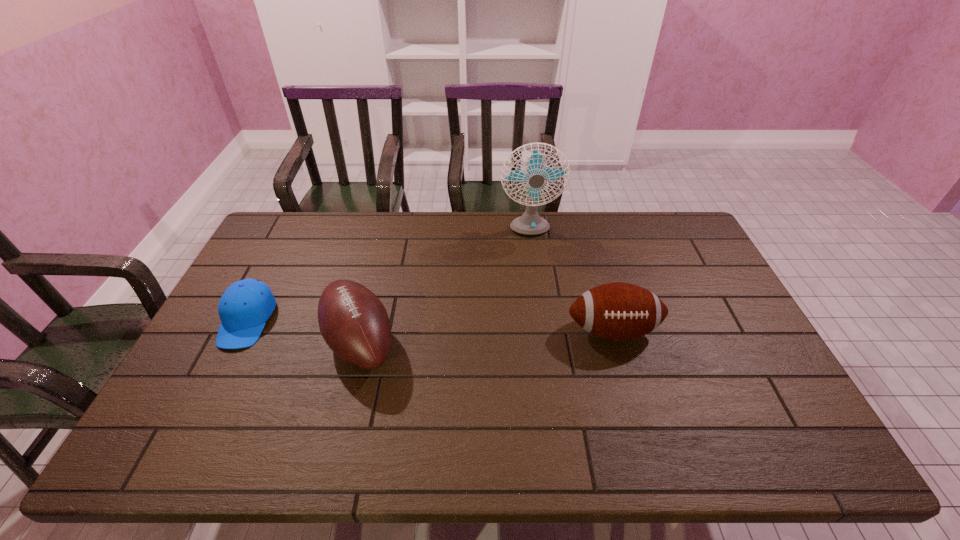
Where is `the farthest object`? This screenshot has width=960, height=540. the farthest object is located at coordinates (530, 223).

Where is `the tallest object`? This screenshot has width=960, height=540. the tallest object is located at coordinates (530, 223).

Locate an element on the screen. the second object from left to right is located at coordinates (354, 323).

Image resolution: width=960 pixels, height=540 pixels. Find the location of `the right football`. the right football is located at coordinates (619, 311).

Identify the location of the shortest object. (245, 306).

Image resolution: width=960 pixels, height=540 pixels. In order to click on the leftmost object in this screenshot , I will do click(245, 306).

Identify the location of vacant space located 0.350m on the front-facing side of the fan. The width and height of the screenshot is (960, 540). (540, 319).

You are a GUI agent. You are given a task and a screenshot of the screen. Output one action in this format:
    pyautogui.click(x=<x>, y=<y>)
    Task: Click on the vacant position located on the front of the second object from left to right
    This screenshot has height=540, width=960.
    Given the screenshot: What is the action you would take?
    pyautogui.click(x=342, y=416)

You are a GUI agent. You are given a task and a screenshot of the screen. Output one action in this format:
    pyautogui.click(x=<x>, y=<y>)
    Task: Click on the vacant space situated 0.300m on the laces of the right football
    The image size is (960, 540).
    Given the screenshot: What is the action you would take?
    pyautogui.click(x=650, y=462)

I want to click on vacant area situated on the front-facing side of the leftmost object, so click(x=181, y=450).